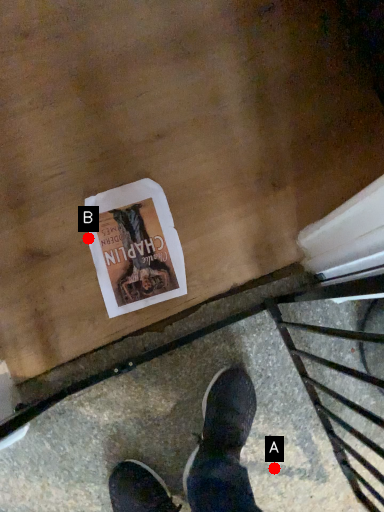
Question: Two points are circled on the image, labeled by A and B beside each circle. Which point is further to the camera?

Choices:
 (A) A is further
 (B) B is further

Answer: (B)